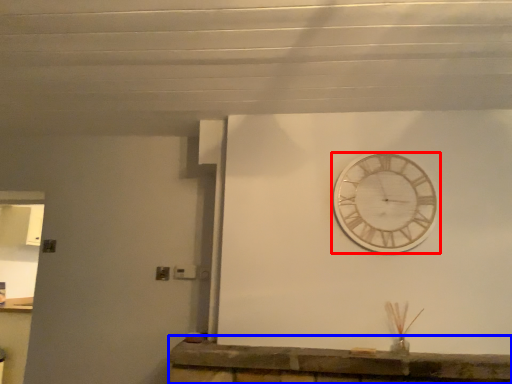
Question: Which object appears farthest to the camera in this image, wall clock (highlighted by a red box) or counter (highlighted by a blue box)?

Choices:
 (A) wall clock
 (B) counter

Answer: (A)